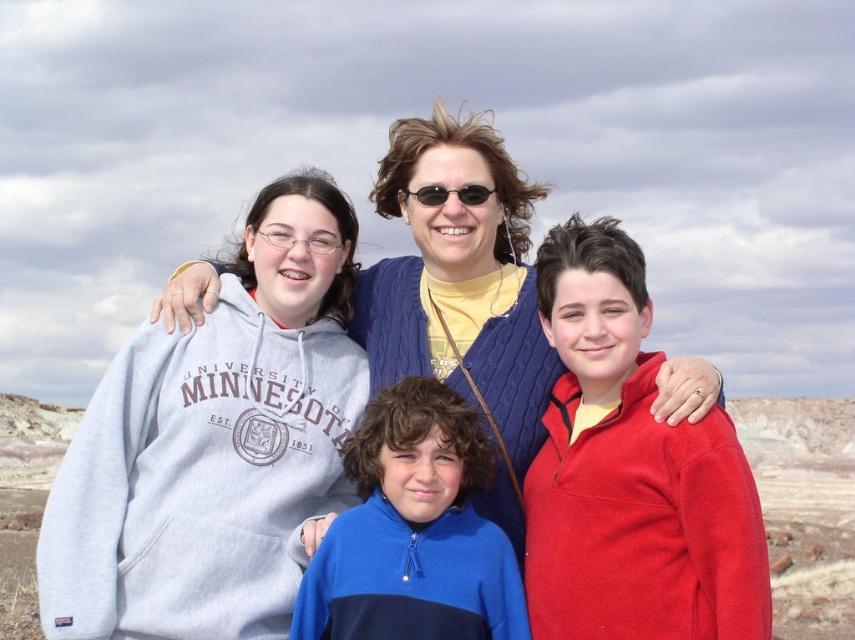
Is matte red fleece jacket at right further to camera compared to blue knit sweater at center?

That is False.

Which is in front, point (575, 253) or point (485, 221)?

Positioned in front is point (575, 253).

Does point (637, 582) come in front of point (691, 387)?

Yes, it is.

You are a GUI agent. You are given a task and a screenshot of the screen. Output one action in this format:
    pyautogui.click(x=<x>, y=<y>)
    Task: Click on the matte red fleece jacket at right
    The width and height of the screenshot is (855, 640).
    Given the screenshot: What is the action you would take?
    tap(629, 472)

Can you confirm if gray fleece sweatshirt at upper left is bigger than sunglasses at center?

Yes, gray fleece sweatshirt at upper left is bigger than sunglasses at center.

Can you confirm if gray fleece sweatshirt at upper left is positioned above sunglasses at center?

No, gray fleece sweatshirt at upper left is not above sunglasses at center.

Is point (223, 636) more distant than point (433, 205)?

No.

Identify the location of gray fleece sweatshirt at upper left. The image size is (855, 640). (199, 480).

Can you confirm if blue knit sweater at center is positioned below blue fleece jacket at center?

Actually, blue knit sweater at center is above blue fleece jacket at center.

Does blue knit sweater at center appear on the left side of blue fleece jacket at center?

Incorrect, blue knit sweater at center is not on the left side of blue fleece jacket at center.

Locate an element on the screen. The image size is (855, 640). blue knit sweater at center is located at coordinates (463, 292).